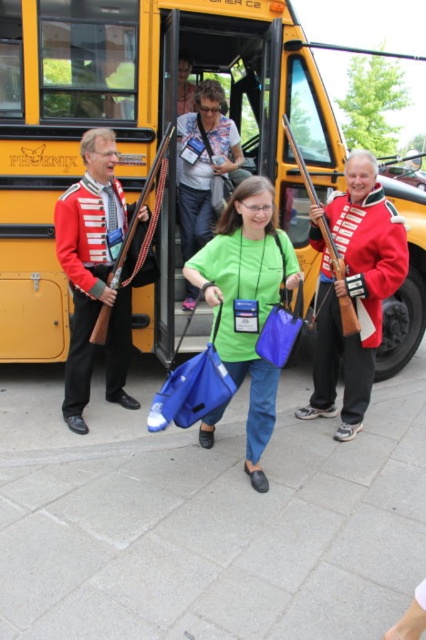
You are a photographer standing in front of the yellow matte school bus at center and the denim jacket at center. Which object is nearer to you?

The yellow matte school bus at center is closer to the viewer than the denim jacket at center, so the yellow matte school bus at center is nearer to you.

You are a photographer trying to capture a photo of the yellow matte school bus at center and the red wool coat at right from a distance. Which object will appear larger in your photo?

The yellow matte school bus at center will appear larger in the photo because it is taller than the red wool coat at right.

What object is located at the coordinate point (138, 124) in the image?

The point (138, 124) corresponds to the yellow matte school bus at center.